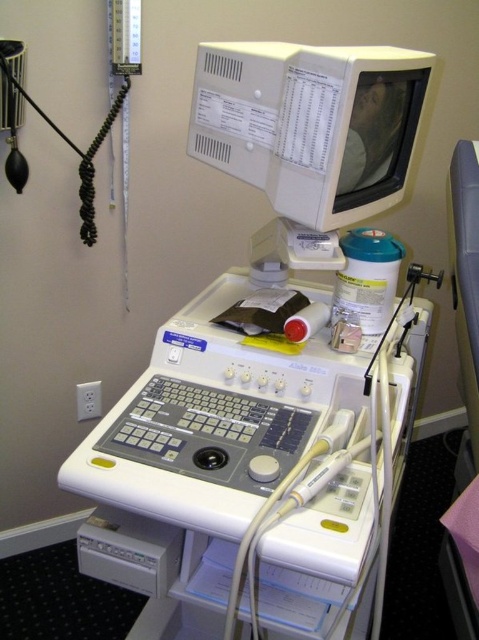
You are a technician standing at the workstation. You need to reach the point marked at coordinates point (211, 422). Your arm can extend 0.9 meters. Can you reach it without moving your body?

The point (211, 422) is 1.02 meters away from the camera. Since your arm can only extend 0.9 meters, you cannot reach it without moving your body.

You are a technician standing in front of the workstation. You need to place a new transducer cable on the surface of the white plastic ultrasound machine at center. Based on the workstation layout, where should you place the cable?

The white plastic ultrasound machine at center is located at point (252, 465), so you should place the new transducer cable near that coordinate on the workstation surface.

You are a technician standing 3 feet away from the workstation. You need to adjust the settings on the white plastic ultrasound machine at center. Can you reach it without moving closer?

The white plastic ultrasound machine at center is 30.71 inches from viewer, which is approximately 2.56 feet. Since you are standing 3 feet away, you can comfortably reach it without needing to move closer.